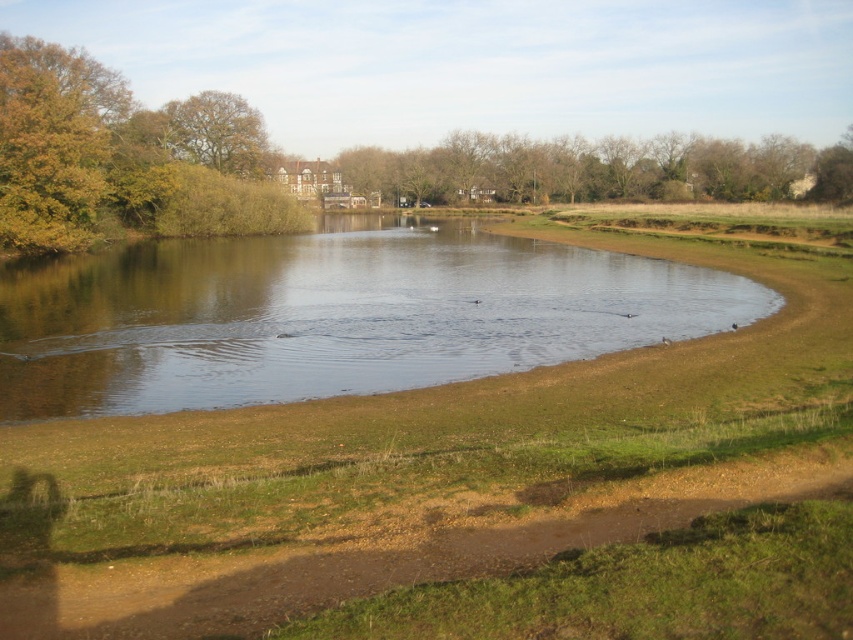
Which of these two, green leafy trees at left or brown leafy tree at upper left, stands taller?

green leafy trees at left

Which is in front, point (167, 120) or point (250, 134)?

Point (167, 120) is more forward.

This screenshot has height=640, width=853. What do you see at coordinates (125, 157) in the screenshot?
I see `green leafy trees at left` at bounding box center [125, 157].

The width and height of the screenshot is (853, 640). I want to click on green leafy trees at left, so click(x=125, y=157).

Which is more to the right, green grass at center or brown leafy trees at upper center?

From the viewer's perspective, brown leafy trees at upper center appears more on the right side.

Is point (152, 636) positioned in front of point (355, 177)?

Yes, it is in front of point (355, 177).

Does point (450, 595) come farther from viewer compared to point (764, 163)?

No, it is not.

Find the location of `green grass at center`. green grass at center is located at coordinates (465, 492).

Does green grass at center lie behind green leafy trees at left?

That is False.

Can you confirm if green grass at center is positioned below green leafy trees at left?

Indeed, green grass at center is positioned under green leafy trees at left.

Where is `green grass at center`? This screenshot has width=853, height=640. green grass at center is located at coordinates (465, 492).

Image resolution: width=853 pixels, height=640 pixels. Identify the location of green grass at center. (465, 492).